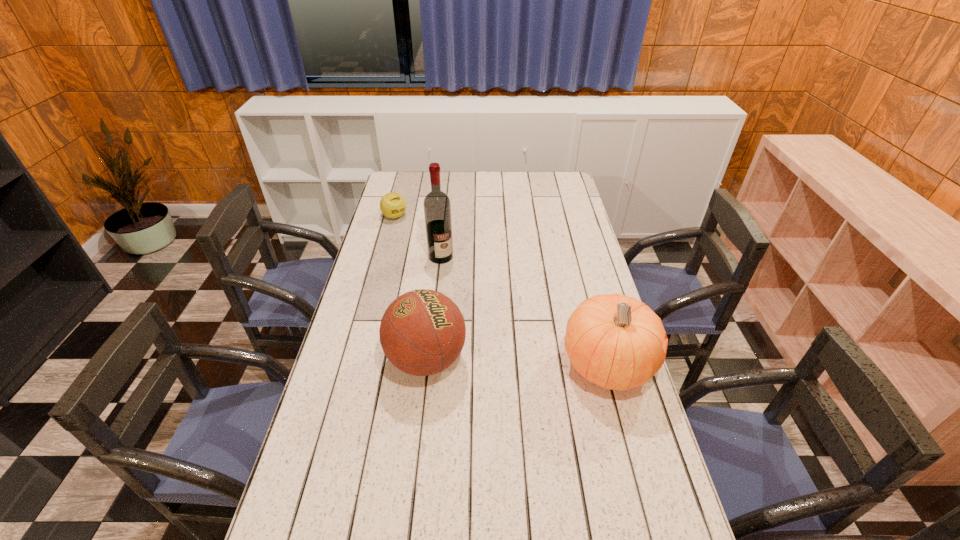
Identify the location of vacant space on the desktop that is between the basketball and the rightmost object and is positioned on the front and back of the alcohol. (513, 362).

You are a GUI agent. You are given a task and a screenshot of the screen. Output one action in this format:
    pyautogui.click(x=<x>, y=<y>)
    Task: Click on the free space on the desktop that is between the basketball and the rightmost object and is positioned on the logo side of the shortest object
    The width and height of the screenshot is (960, 540).
    Given the screenshot: What is the action you would take?
    pyautogui.click(x=540, y=363)